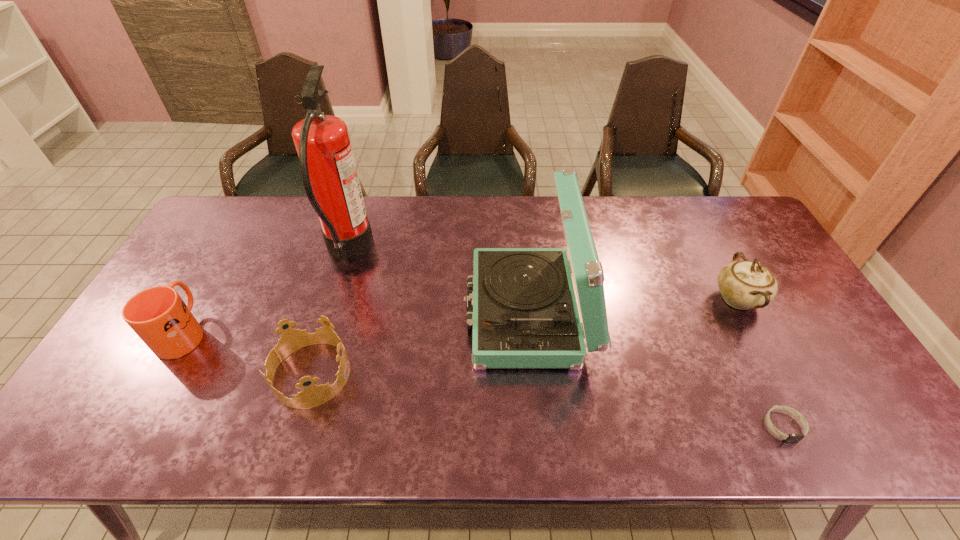
The height and width of the screenshot is (540, 960). Identify the location of vacant space that satisfies the following two spatial constraints: 1. on the handle side of the chinaware; 2. on the left side of the mug. (204, 299).